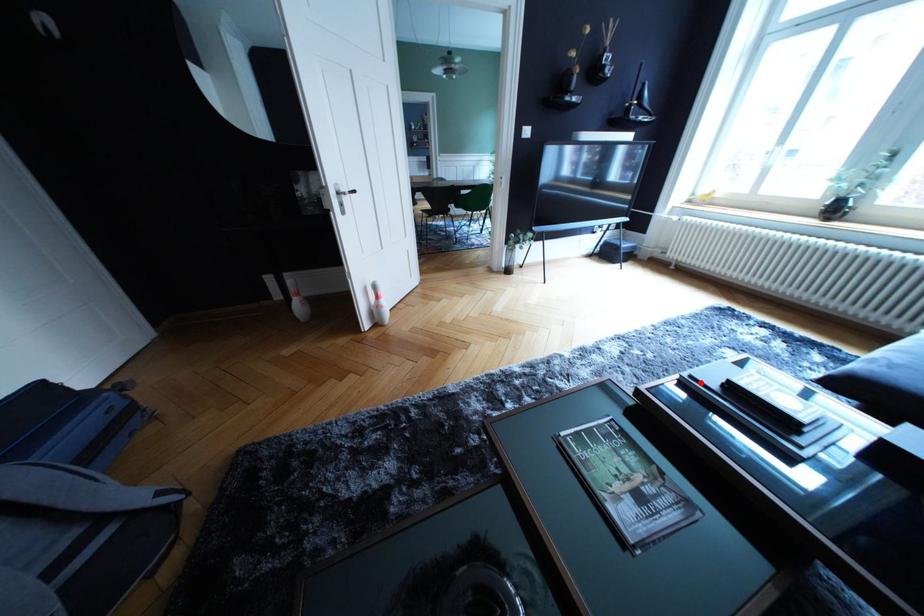
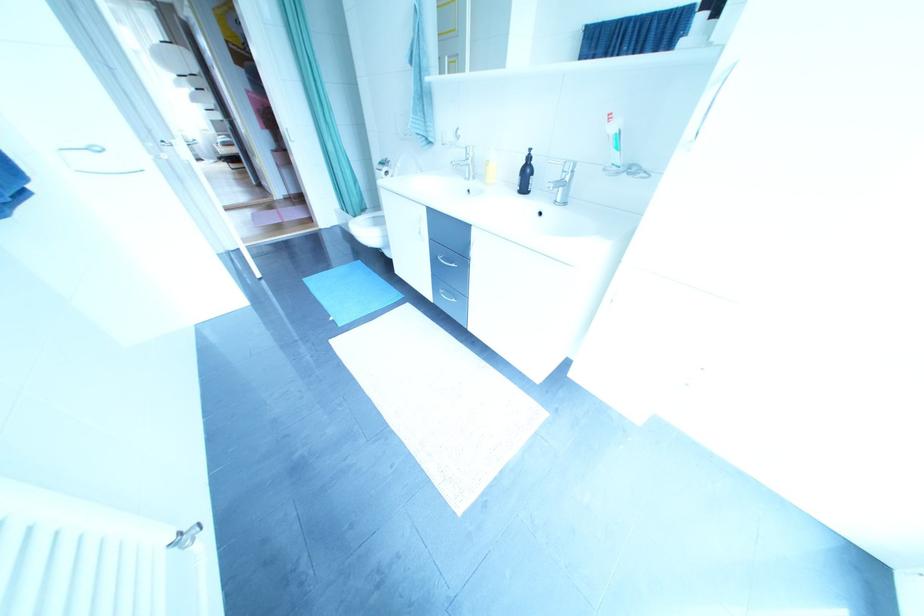
Question: I am providing you with two images of the same scene from different viewpoints. A red point is marked on the first image. Can you still see the location of the red point in image 2?

Choices:
 (A) Yes
 (B) No

Answer: (B)